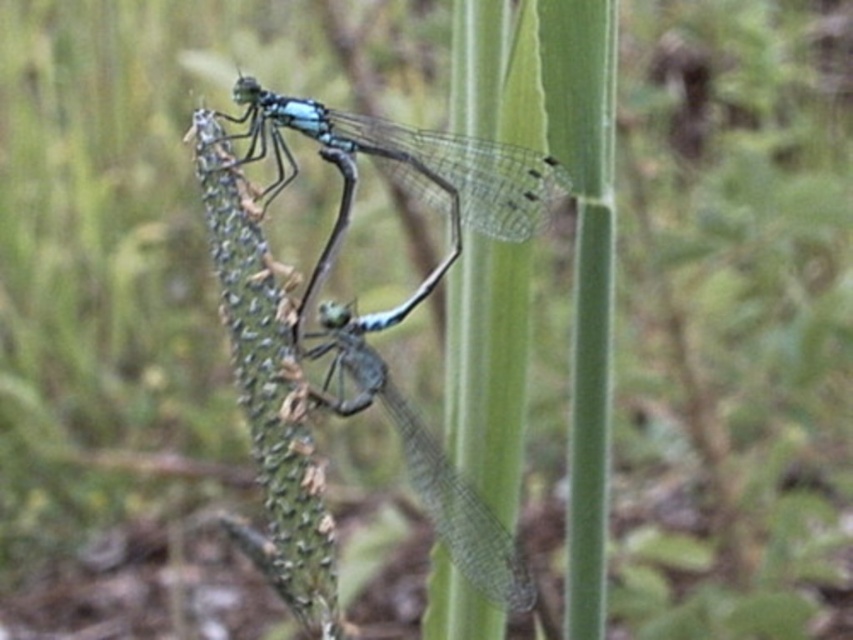
Question: Is translucent blue dragonfly at center closer to the viewer compared to transparent blue dragonfly at center?

Choices:
 (A) no
 (B) yes

Answer: (A)

Question: Is translucent blue dragonfly at center thinner than transparent blue dragonfly at center?

Choices:
 (A) no
 (B) yes

Answer: (A)

Question: Does translucent blue dragonfly at center appear under transparent blue dragonfly at center?

Choices:
 (A) yes
 (B) no

Answer: (B)

Question: Among these points, which one is farthest from the camera?

Choices:
 (A) (419, 429)
 (B) (521, 148)

Answer: (B)

Question: Which point is closer to the camera taking this photo?

Choices:
 (A) (448, 468)
 (B) (549, 172)

Answer: (A)